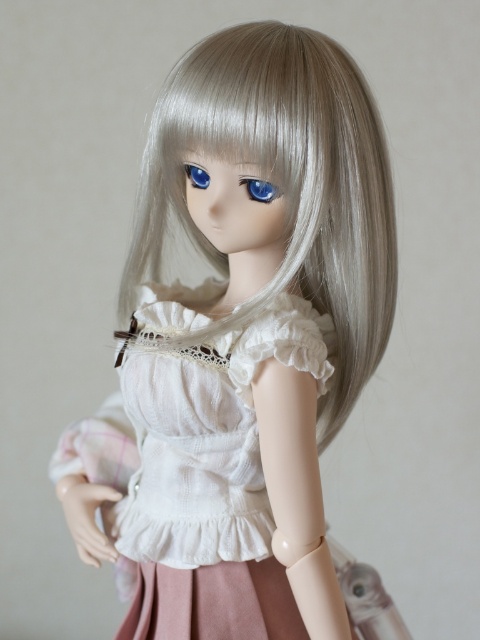
You are a photographer trying to capture the perfect shot of the doll. You notice two points marked in the image. The first point is at coordinates point (316, 611) and the second is at point (225, 552). From the photographer perspective, which point is closer to the camera?

Point (316, 611) is in front of point (225, 552), so the first point is closer to the camera.